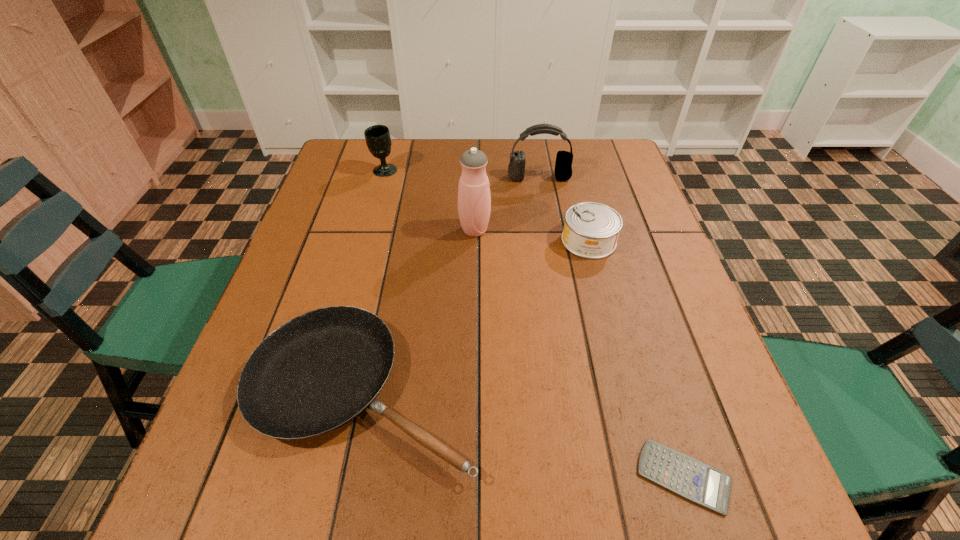
Locate an element on the screen. The width and height of the screenshot is (960, 540). object that is at the far left corner is located at coordinates (378, 139).

This screenshot has width=960, height=540. What are the coordinates of `object located in the near left corner section of the desktop` in the screenshot? It's located at (317, 372).

This screenshot has width=960, height=540. Identify the location of object situated at the near right corner. (692, 479).

This screenshot has height=540, width=960. In the image, there is a desktop. What are the coordinates of `free space at the far edge` in the screenshot? It's located at (398, 153).

This screenshot has width=960, height=540. In the image, there is a desktop. In order to click on vacant space at the left edge in this screenshot , I will do `click(355, 216)`.

You are a GUI agent. You are given a task and a screenshot of the screen. Output one action in this format:
    pyautogui.click(x=<x>, y=<y>)
    Task: Click on the free space at the right edge of the desktop
    
    Given the screenshot: What is the action you would take?
    pyautogui.click(x=627, y=195)

Locate an element on the screen. The height and width of the screenshot is (540, 960). vacant area at the far right corner of the desktop is located at coordinates (604, 156).

You are a GUI agent. You are given a task and a screenshot of the screen. Output one action in this format:
    pyautogui.click(x=<x>, y=<y>)
    Task: Click on the free spot at the near right corner of the desktop
    
    Given the screenshot: What is the action you would take?
    pyautogui.click(x=683, y=537)

The height and width of the screenshot is (540, 960). I want to click on vacant area that lies between the headset and the can, so click(564, 210).

The image size is (960, 540). I want to click on free spot between the fifth tallest object and the chalice, so click(373, 280).